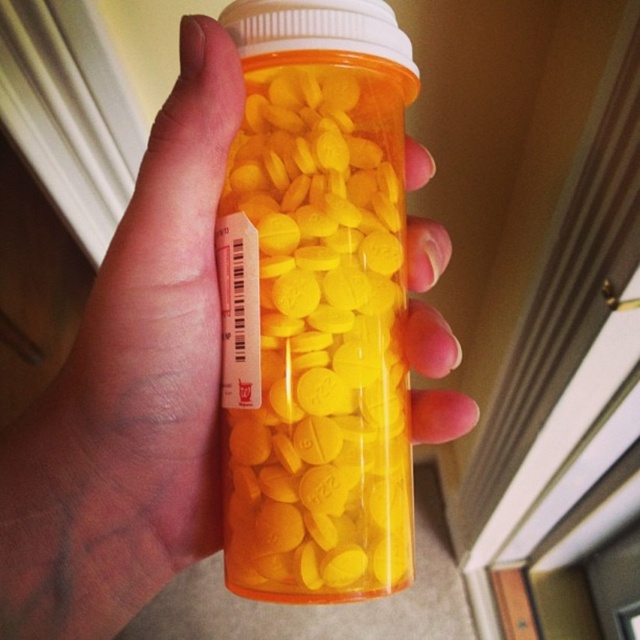
You are a pharmacist trying to determine if the translucent orange pill bottle at center can fit inside a storage compartment that is the same width as the matte plastic hand at center. Based on the description, will the bottle fit?

The translucent orange pill bottle at center is thinner than the matte plastic hand at center, so it will fit inside the storage compartment since it is narrower than the hand.

You are a pharmacist who needs to photograph a pill bottle for a medication guide. You have a translucent orange pill bottle at center. According to the guidelines, the camera must be positioned exactly 16 inches away from the subject to ensure proper focus. Is your current distance correct?

The translucent orange pill bottle at center and camera are 16.48 inches apart, which is slightly more than the required 16 inches. Adjust the distance to meet the exact requirement for proper focus.

You are a pharmacist who needs to place the translucent orange pill bottle at center into a storage box. The storage box has a height limit of 10 cm. Given that the matte plastic hand at center is 12 cm tall, can the pill bottle fit vertically in the box?

The translucent orange pill bottle at center is not as tall as the matte plastic hand at center, which is 12 cm tall. Since the bottle is shorter than 12 cm and the storage box has a height limit of 10 cm, the pill bottle may not fit vertically if its height exceeds 10 cm. However, without knowing the exact height of the bottle, we cannot confirm for sure.